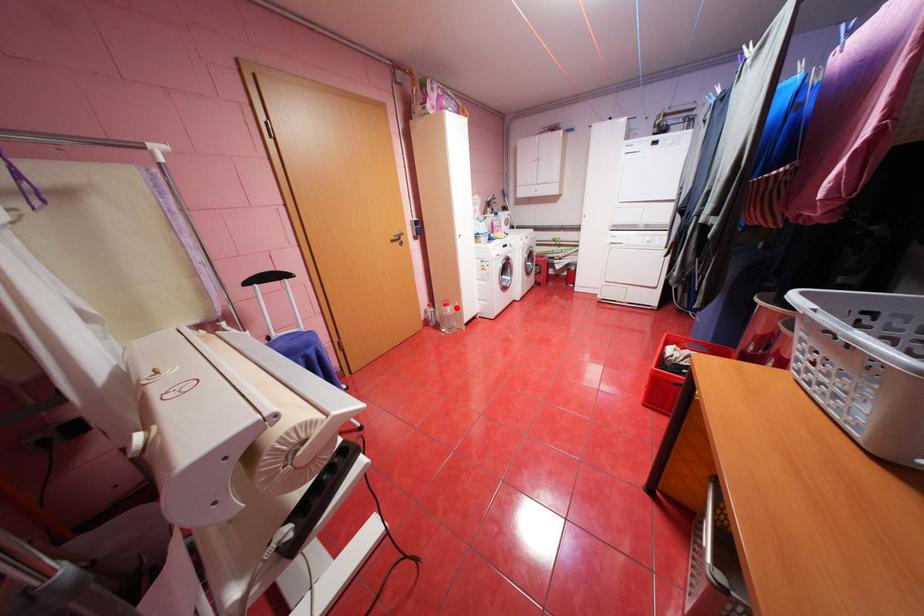
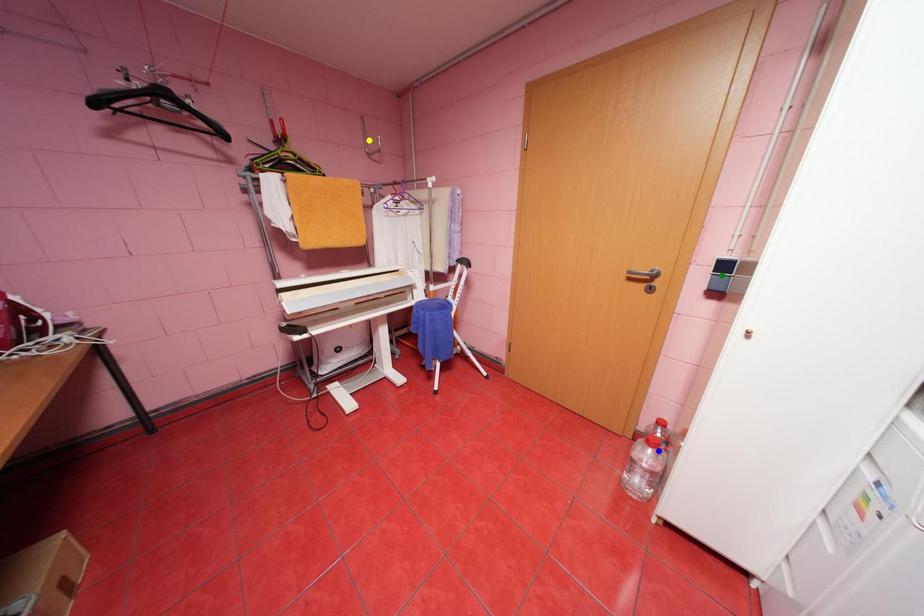
Question: I am providing you with two images of the same scene from different viewpoints. A red point is marked on the first image. You are given multiple points on the second image. Can you choose the point in image 2 that corresponds to the point in image 1?

Choices:
 (A) blue point
 (B) yellow point
 (C) green point

Answer: (A)